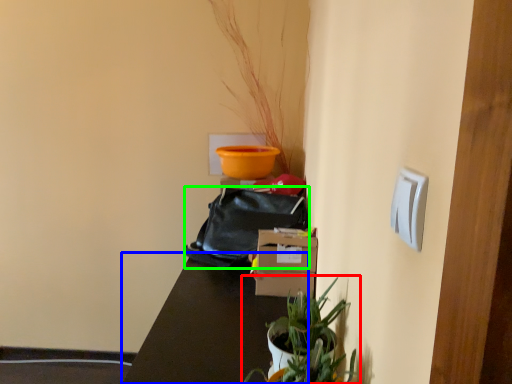
Question: Considering the real-world distances, which object is farthest from houseplant (highlighted by a red box)? table (highlighted by a blue box) or bag (highlighted by a green box)?

Choices:
 (A) table
 (B) bag

Answer: (B)